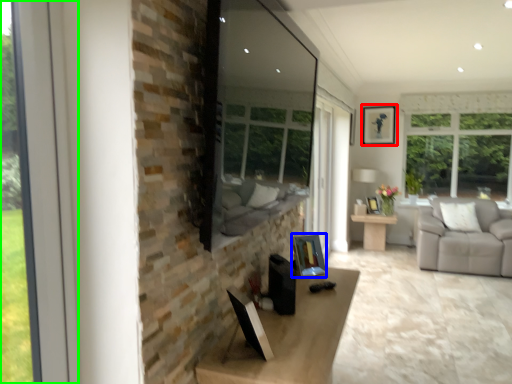
Question: Which is nearer to the picture frame (highlighted by a red box)? picture frame (highlighted by a blue box) or window (highlighted by a green box).

Choices:
 (A) picture frame
 (B) window

Answer: (A)